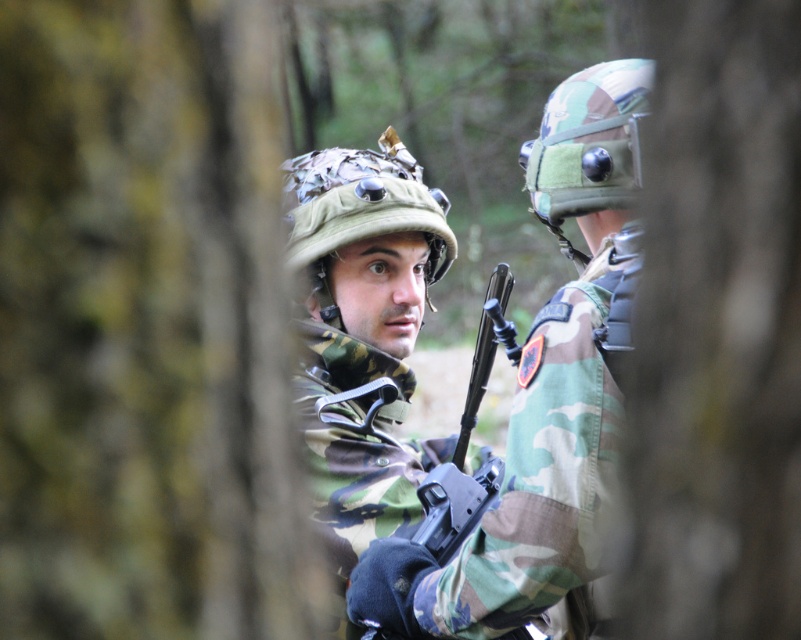
You are a GUI agent. You are given a task and a screenshot of the screen. Output one action in this format:
    pyautogui.click(x=<x>, y=<y>)
    Task: Click on the camo fabric helmet at center
    The width and height of the screenshot is (801, 640).
    Given the screenshot: What is the action you would take?
    pyautogui.click(x=546, y=401)

Is camo fabric helmet at center bigger than matte black rifle at center?

Yes.

Which is behind, point (554, 596) or point (490, 476)?

Point (490, 476)

Locate an element on the screen. camo fabric helmet at center is located at coordinates (546, 401).

Is camo fabric helmet at center positioned in front of camouflage fabric uniform at center?

Yes.

Where is `camo fabric helmet at center`? Image resolution: width=801 pixels, height=640 pixels. camo fabric helmet at center is located at coordinates (546, 401).

Where is `camo fabric helmet at center`? The width and height of the screenshot is (801, 640). camo fabric helmet at center is located at coordinates (546, 401).

You are a GUI agent. You are given a task and a screenshot of the screen. Output one action in this format:
    pyautogui.click(x=<x>, y=<y>)
    Task: Click on the brown rough bark at center
    
    Given the screenshot: What is the action you would take?
    pyautogui.click(x=715, y=323)

Find the location of a particular element. Image resolution: width=801 pixels, height=640 pixels. brown rough bark at center is located at coordinates (715, 323).

This screenshot has width=801, height=640. Find the location of `brown rough bark at center`. brown rough bark at center is located at coordinates (715, 323).